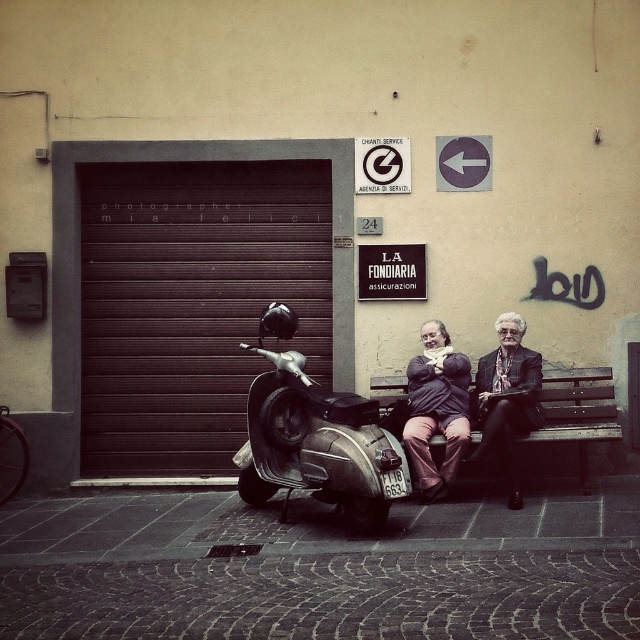
Is matte black jacket at center smaller than wooden bench at center?

Correct, matte black jacket at center occupies less space than wooden bench at center.

Is the position of matte black jacket at center less distant than that of wooden bench at center?

Yes.

What do you see at coordinates (436, 408) in the screenshot? The width and height of the screenshot is (640, 640). I see `matte black jacket at center` at bounding box center [436, 408].

The image size is (640, 640). Find the location of `matte black jacket at center`. matte black jacket at center is located at coordinates (436, 408).

Is point (483, 360) positioned after point (433, 346)?

Yes, it is behind point (433, 346).

Is matte black coat at center positioned behind matte black jacket at center?

No.

Is point (509, 413) farther from camera compared to point (448, 360)?

No, (509, 413) is in front of (448, 360).

Locate an element on the screen. matte black coat at center is located at coordinates (506, 397).

Does shiny metallic scooter at center have a greater width compared to wooden bench at center?

Indeed, shiny metallic scooter at center has a greater width compared to wooden bench at center.

The height and width of the screenshot is (640, 640). I want to click on shiny metallic scooter at center, so click(316, 436).

Image resolution: width=640 pixels, height=640 pixels. I want to click on shiny metallic scooter at center, so click(316, 436).